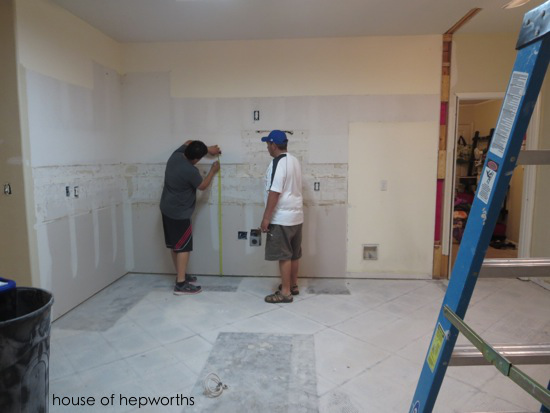
At what (x,y) coordinates should I click in order to perform the action: click on tile floor. Please return your answer as a coordinate pair (x, y). Looking at the image, I should click on (207, 327).